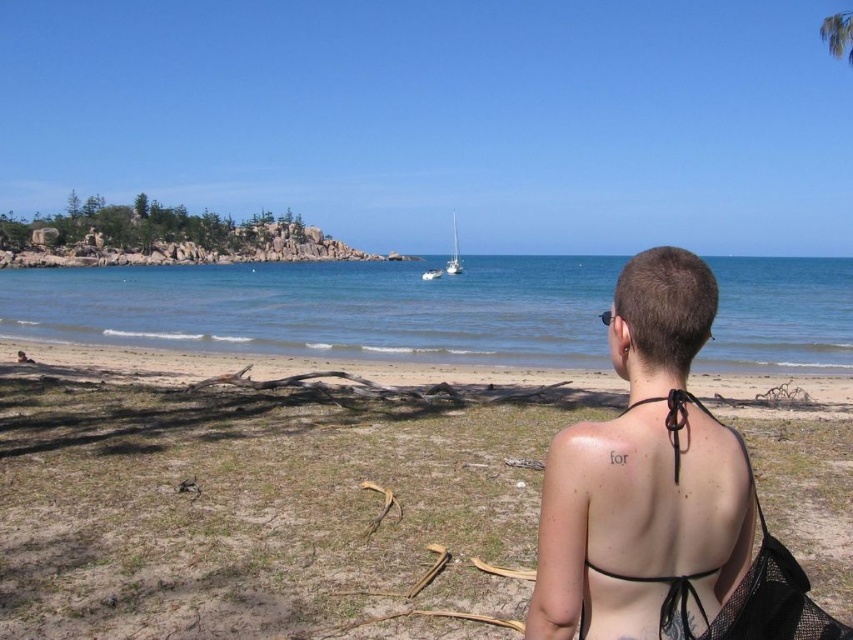
You are a photographer trying to capture the view from the beach. You notice the brown sand at lower center and the skinny black bikini top at center. Which object is positioned lower in the image?

The brown sand at lower center is located below the skinny black bikini top at center, so it is positioned lower in the image.

You are standing on the beach and want to take a photo of the green leafy palm tree at upper right and the white glossy sailboat at center. Which object should you point your camera towards first to capture both in the same frame?

The green leafy palm tree at upper right is above the white glossy sailboat at center, so you should point your camera upwards to include both in the frame.

You are a photographer trying to capture the skinny black bikini top at center and the brown sand at lower center in a single shot. Which object will appear larger in the photo?

The brown sand at lower center will appear larger in the photo because it is physically larger in size than the skinny black bikini top at center.